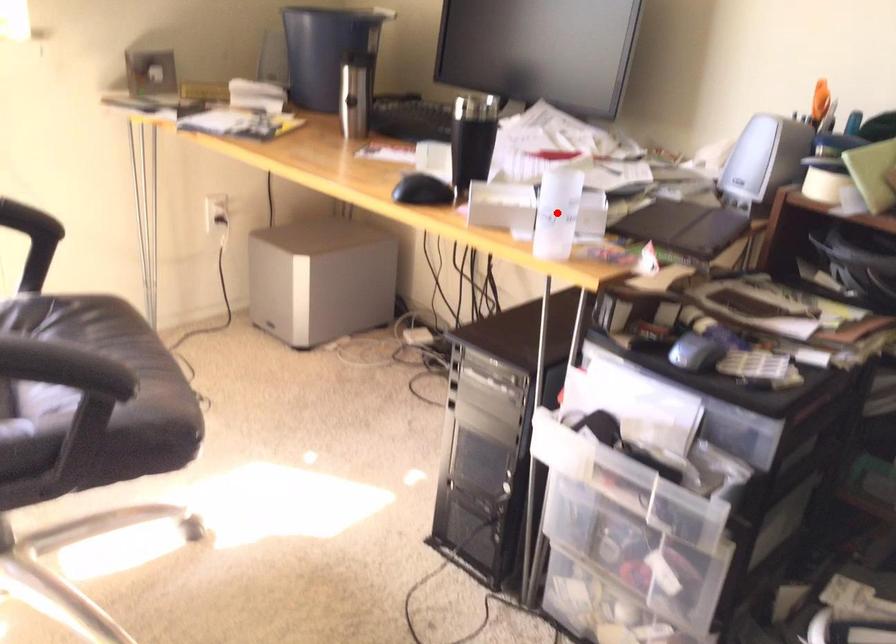
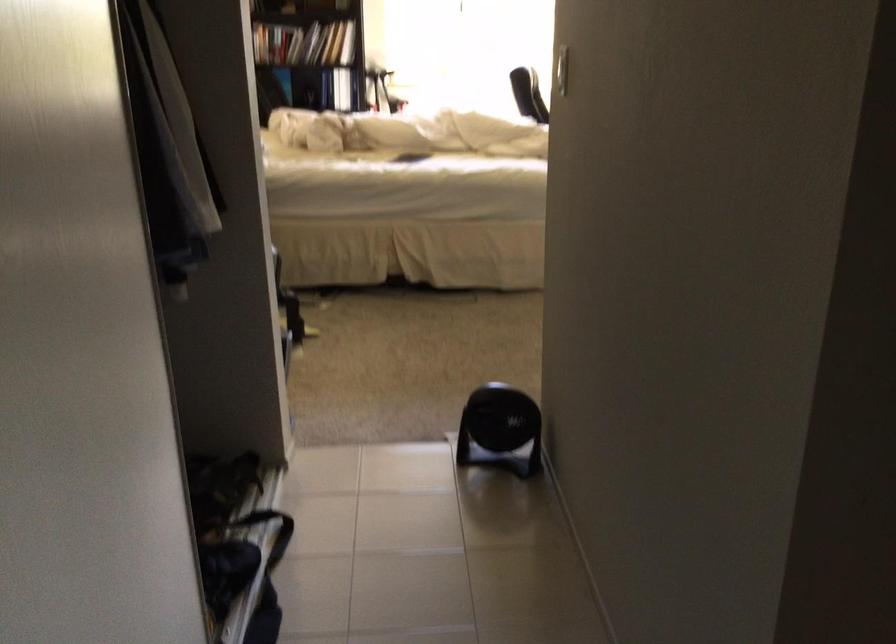
Question: I am providing you with two images of the same scene from different viewpoints. A red point is marked on the first image. Is the red point's position out of view in image 2?

Choices:
 (A) Yes
 (B) No

Answer: (A)